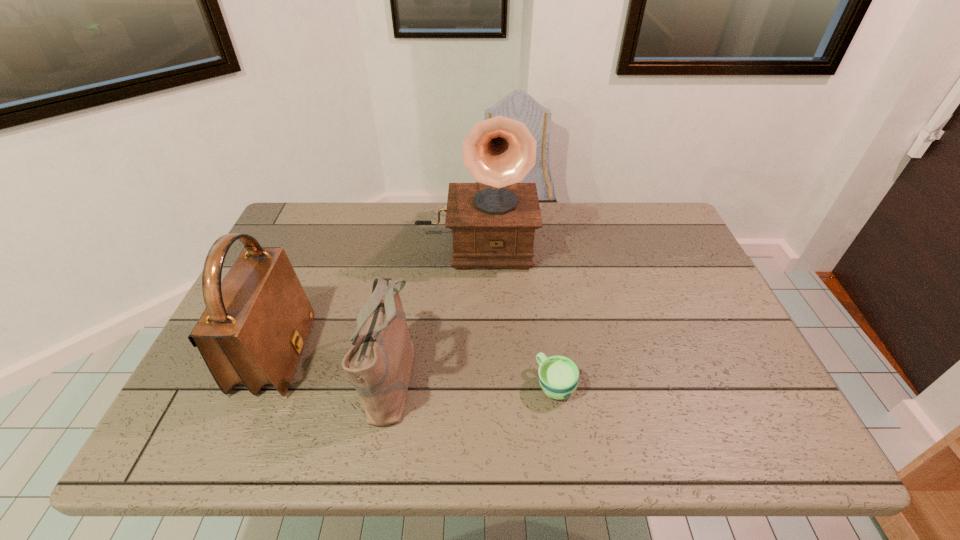
This screenshot has height=540, width=960. Identify the location of empty space that is in between the record player and the cup. (516, 313).

The image size is (960, 540). What are the coordinates of `vacant area that lies between the tallest object and the right shoulder bag` in the screenshot? It's located at (433, 309).

Where is `free space between the tallest object and the right shoulder bag`? free space between the tallest object and the right shoulder bag is located at coordinates (433, 309).

I want to click on object that is the third closest to the right shoulder bag, so click(x=558, y=376).

I want to click on the second closest object to the right shoulder bag, so click(493, 222).

The width and height of the screenshot is (960, 540). What are the coordinates of `free space that satisfies the following two spatial constraints: 1. on the front flap of the left shoulder bag; 2. on the back side of the shortest object` in the screenshot? It's located at (263, 384).

Find the location of a particular element. blank area in the image that satisfies the following two spatial constraints: 1. on the front-facing side of the right shoulder bag; 2. on the left side of the cup is located at coordinates (391, 384).

In order to click on free space that satisfies the following two spatial constraints: 1. on the horn of the tallest object; 2. on the front flap of the left shoulder bag in this screenshot , I will do `click(473, 355)`.

At what (x,y) coordinates should I click in order to perform the action: click on free location that satisfies the following two spatial constraints: 1. on the horn of the farthest object; 2. on the right side of the cup. Please return your answer as a coordinate pair (x, y). Looking at the image, I should click on (473, 384).

What are the coordinates of `vacant area in the image that satisfies the following two spatial constraints: 1. on the front flap of the left shoulder bag; 2. on the left side of the shortest object` in the screenshot? It's located at (263, 384).